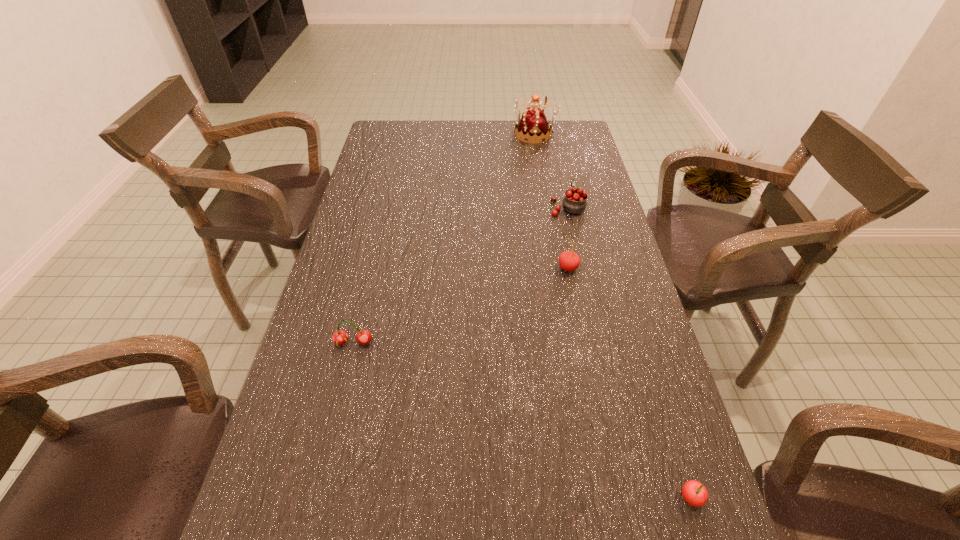
You are a GUI agent. You are given a task and a screenshot of the screen. Output one action in this format:
    pyautogui.click(x=<x>, y=<y>)
    Task: Click on the vacant area in the image that satisfies the following two spatial constraints: 1. with stems pointing upwards on the leftmost cherry; 2. on the left side of the rightmost object
    
    Given the screenshot: What is the action you would take?
    pyautogui.click(x=316, y=498)

Locate an element on the screen. This screenshot has width=960, height=540. vacant space that satisfies the following two spatial constraints: 1. on the front-facing side of the rightmost cherry; 2. on the right side of the tiara is located at coordinates (598, 498).

Identify the location of vacant space that satisfies the following two spatial constraints: 1. on the front-facing side of the tallest object; 2. on the right side of the rightmost cherry. The height and width of the screenshot is (540, 960). pyautogui.click(x=598, y=498).

Where is `vacant space that satisfies the following two spatial constraints: 1. with stems pointing upwards on the second nearest cherry; 2. on the left side of the nearest object`? This screenshot has height=540, width=960. vacant space that satisfies the following two spatial constraints: 1. with stems pointing upwards on the second nearest cherry; 2. on the left side of the nearest object is located at coordinates (x=316, y=498).

Identify the location of vacant space that satisfies the following two spatial constraints: 1. on the front-facing side of the tallest object; 2. on the handle side of the farthest cherry. (547, 207).

Image resolution: width=960 pixels, height=540 pixels. What are the coordinates of `free region that satisfies the following two spatial constraints: 1. on the front-facing side of the tallest object; 2. with stems pointing upwards on the fourth farthest object` in the screenshot? It's located at (571, 343).